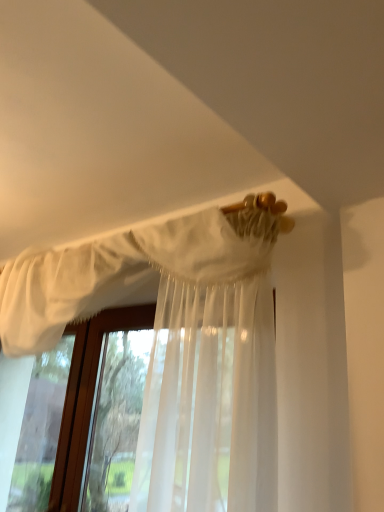
Where is `sheer white curtain at upper center`? The height and width of the screenshot is (512, 384). sheer white curtain at upper center is located at coordinates (176, 348).

What do you see at coordinates (176, 348) in the screenshot?
I see `sheer white curtain at upper center` at bounding box center [176, 348].

Locate an element on the screen. This screenshot has height=512, width=384. sheer white curtain at upper center is located at coordinates (176, 348).